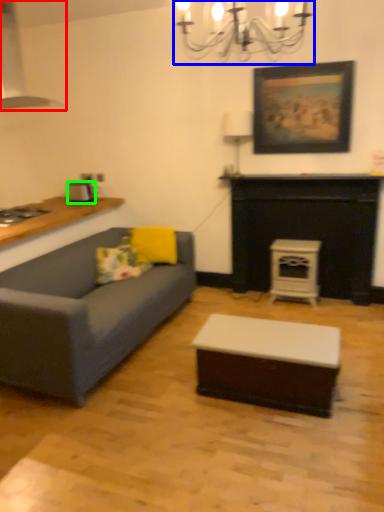
Question: Estimate the real-world distances between objects in this image. Which object is closer to exhaust hood (highlighted by a red box), light fixture (highlighted by a blue box) or appliance (highlighted by a green box)?

Choices:
 (A) light fixture
 (B) appliance

Answer: (B)